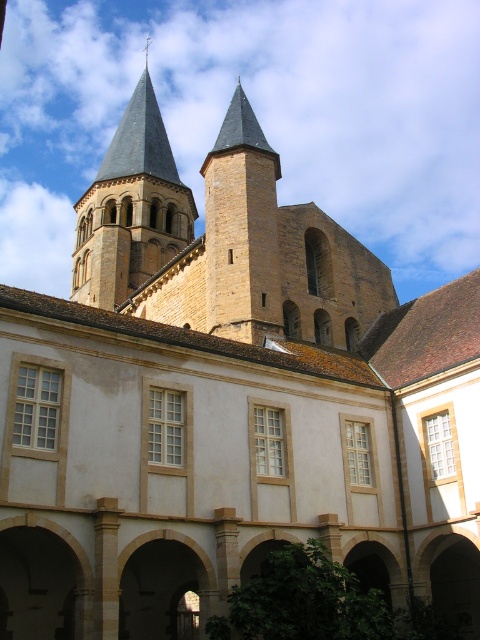
You are an architect inspecting the building. You need to determine which structure is bigger between the smooth gray steeple at upper center and the smooth stone tower at center. Based on the image, which one is larger?

The smooth gray steeple at upper center has a larger size compared to the smooth stone tower at center, so the smooth gray steeple at upper center is bigger.

You are standing at the base of the historic building and want to locate the smooth gray steeple at upper center. According to the coordinates provided, what are the exact coordinates where you should look to find it?

The smooth gray steeple at upper center is located at coordinates point (x=131, y=208).

You are an architect examining the historic building. You notice the smooth gray steeple at upper center and the smooth stone tower at center. Which of these two structures is positioned higher in the image?

The smooth gray steeple at upper center is positioned higher than the smooth stone tower at center because it is located above it.